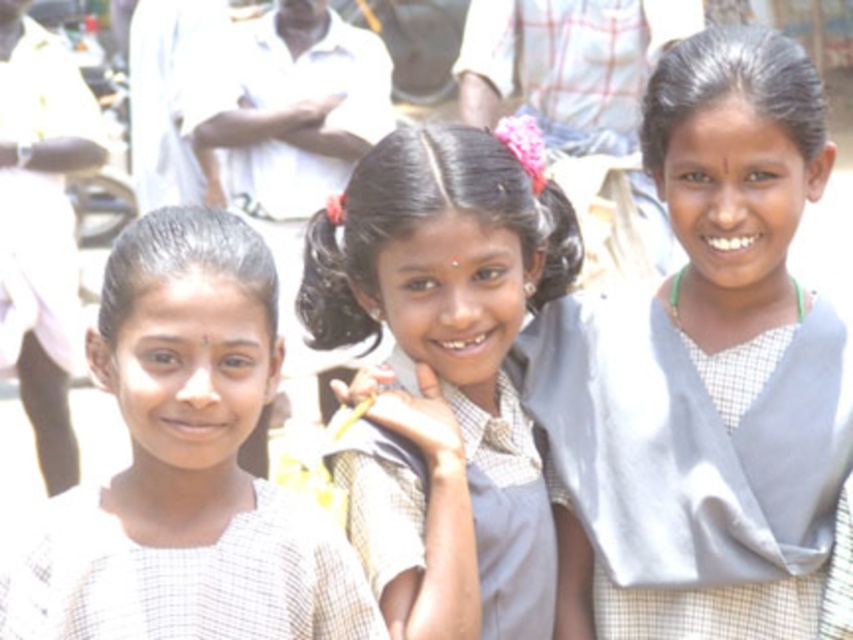
Between light gray fabric sari at center and white checkered shirt at left, which one is positioned higher?

Positioned higher is white checkered shirt at left.

Does point (641, 584) come in front of point (131, 605)?

That is False.

Locate an element on the screen. light gray fabric sari at center is located at coordinates (704, 376).

Measure the distance between point (689, 406) and camera.

Point (689, 406) is 17.35 meters away from camera.

Can you confirm if light gray fabric sari at center is positioned to the left of matte gray uniform at center?

In fact, light gray fabric sari at center is to the right of matte gray uniform at center.

Is point (535, 413) farther from viewer compared to point (473, 436)?

Yes, it is.

Identify the location of light gray fabric sari at center. (704, 376).

Is matte gray uniform at center further to camera compared to white checkered shirt at left?

That is True.

Is matte gray uniform at center wider than white checkered shirt at left?

In fact, matte gray uniform at center might be narrower than white checkered shirt at left.

Describe the element at coordinates (444, 372) in the screenshot. I see `matte gray uniform at center` at that location.

The image size is (853, 640). Find the location of `matte gray uniform at center`. matte gray uniform at center is located at coordinates pos(444,372).